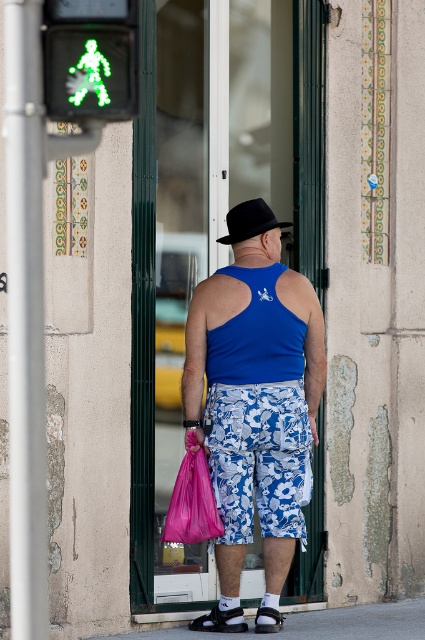
Does blue floral shorts at center have a greater height compared to black felt hat at center?

Indeed, blue floral shorts at center has a greater height compared to black felt hat at center.

Who is more distant from viewer, [289,436] or [257,228]?

Point [257,228]

Find the location of a particular element. blue floral shorts at center is located at coordinates (258, 458).

Who is more distant from viewer, (299,508) or (303,368)?

The point (303,368) is more distant.

Looking at this image, which is more to the right, blue floral shorts at center or blue matte tank top at center?

blue matte tank top at center

Measure the distance between point (265,406) and camera.

Point (265,406) and camera are 8.25 meters apart from each other.

At what (x,y) coordinates should I click in order to perform the action: click on blue floral shorts at center. Please return your answer as a coordinate pair (x, y). This screenshot has width=425, height=640. Looking at the image, I should click on (258, 458).

Is point (82, 22) in front of point (187, 460)?

Yes, it is in front of point (187, 460).

Between point (121, 35) and point (186, 465), which one is positioned in front?

Point (121, 35) is more forward.

The width and height of the screenshot is (425, 640). I want to click on green led pedestrian at upper left, so click(90, 58).